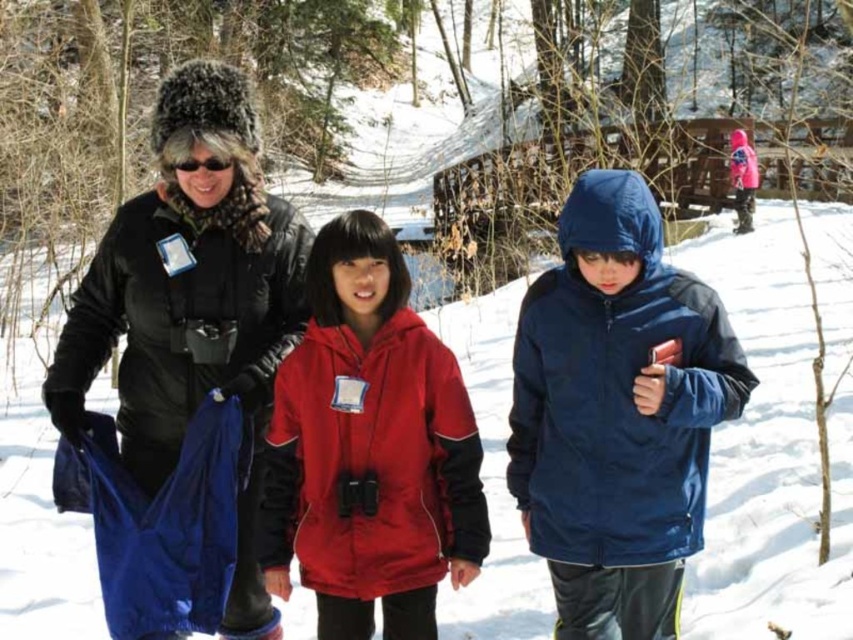
Which is in front, point (543, 556) or point (245, 627)?

Positioned in front is point (543, 556).

The width and height of the screenshot is (853, 640). Find the location of `navy blue softshell jacket at center`. navy blue softshell jacket at center is located at coordinates (618, 413).

At what (x,y) coordinates should I click in order to perform the action: click on black leather jacket at left. Please return your answer as a coordinate pair (x, y). Looking at the image, I should click on (190, 301).

How distant is black leather jacket at left from matte nylon jacket at center?

They are 30.10 inches apart.

Between point (158, 220) and point (473, 424), which one is positioned behind?

The point (158, 220) is behind.

You are a GUI agent. You are given a task and a screenshot of the screen. Output one action in this format:
    pyautogui.click(x=<x>, y=<y>)
    Task: Click on the black leather jacket at left
    
    Given the screenshot: What is the action you would take?
    pyautogui.click(x=190, y=301)

Which is behind, point (549, 540) or point (361, 602)?

Point (549, 540)

Between point (517, 483) and point (334, 269), which one is positioned behind?

Point (517, 483)

Where is `navy blue softshell jacket at center`? navy blue softshell jacket at center is located at coordinates (618, 413).